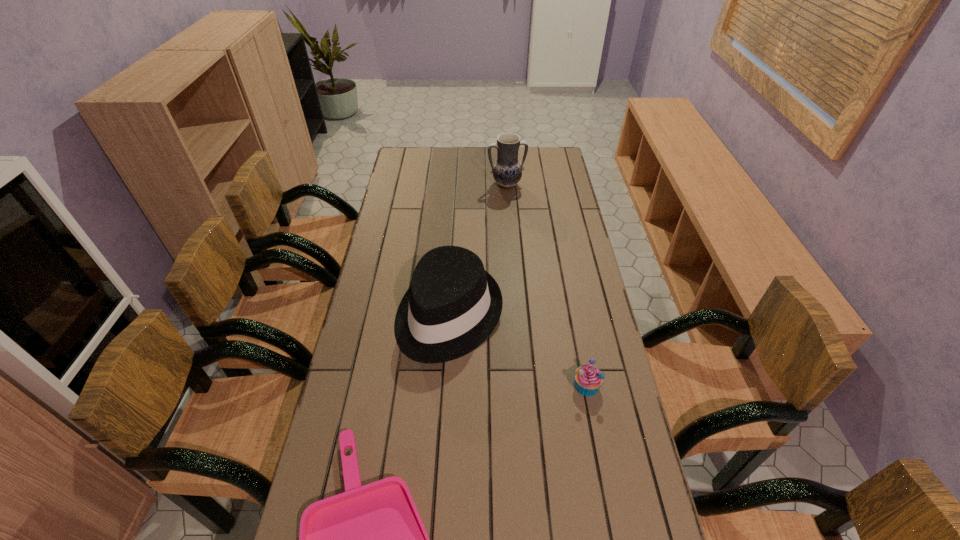
The image size is (960, 540). Find the location of `pottery`. pottery is located at coordinates (507, 171).

This screenshot has height=540, width=960. What are the coordinates of `the third nearest object` in the screenshot? It's located at (452, 306).

Locate an element on the screen. The width and height of the screenshot is (960, 540). the third tallest object is located at coordinates (588, 379).

You are a GUI agent. You are given a task and a screenshot of the screen. Output one action in this format:
    pyautogui.click(x=<x>, y=<y>)
    Task: Click on the rightmost object
    This screenshot has height=540, width=960.
    Given the screenshot: What is the action you would take?
    pyautogui.click(x=588, y=379)

Identify the location of vacant position located on the front of the farthest object. This screenshot has width=960, height=540. [x=510, y=234].

Identify the location of free space located on the back of the third nearest object. (456, 210).

Where is `vacant space located 0.220m on the back of the second nearest object`? vacant space located 0.220m on the back of the second nearest object is located at coordinates (573, 314).

The height and width of the screenshot is (540, 960). Identify the location of object that is at the left edge. 452,306.

Where is `object that is at the right edge`? This screenshot has width=960, height=540. object that is at the right edge is located at coordinates (588, 379).

The width and height of the screenshot is (960, 540). I want to click on vacant space at the far edge of the desktop, so click(x=455, y=148).